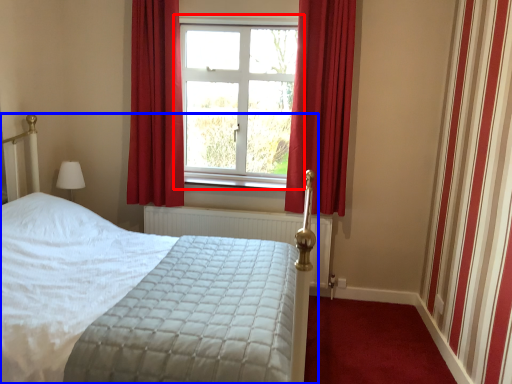
Question: Which object is further to the camera taking this photo, window (highlighted by a red box) or bed (highlighted by a blue box)?

Choices:
 (A) window
 (B) bed

Answer: (A)